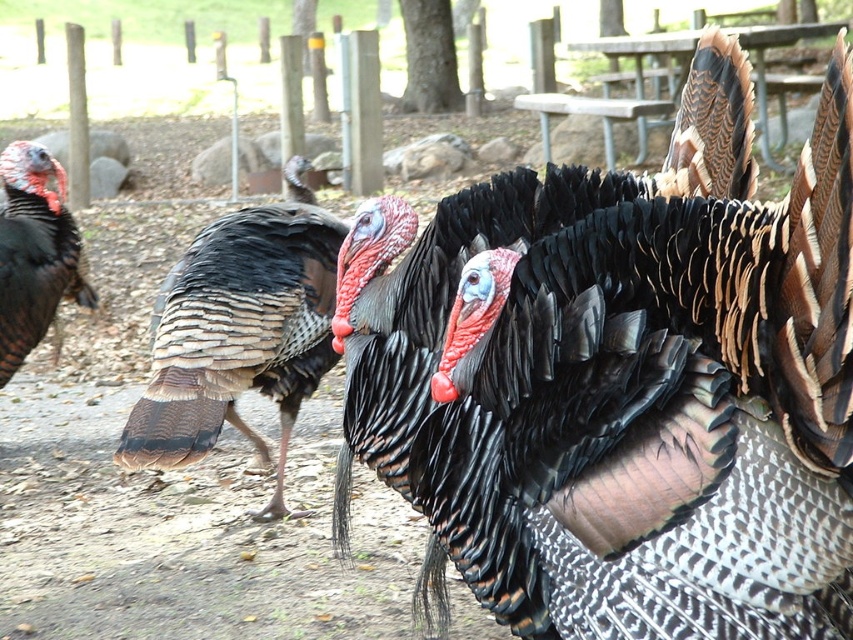
Based on the photo, you are a photographer trying to capture the turkeys in the image. You notice a point at coordinates (630,385). What is the most prominent feature at this location?

The point at (630,385) is where the shiny black feathers at center are located.

You are a park ranger trying to locate a specific turkey in the park. According to the coordinates provided, where exactly is the speckled feathered turkey at center located?

The speckled feathered turkey at center is located at point (238, 333).